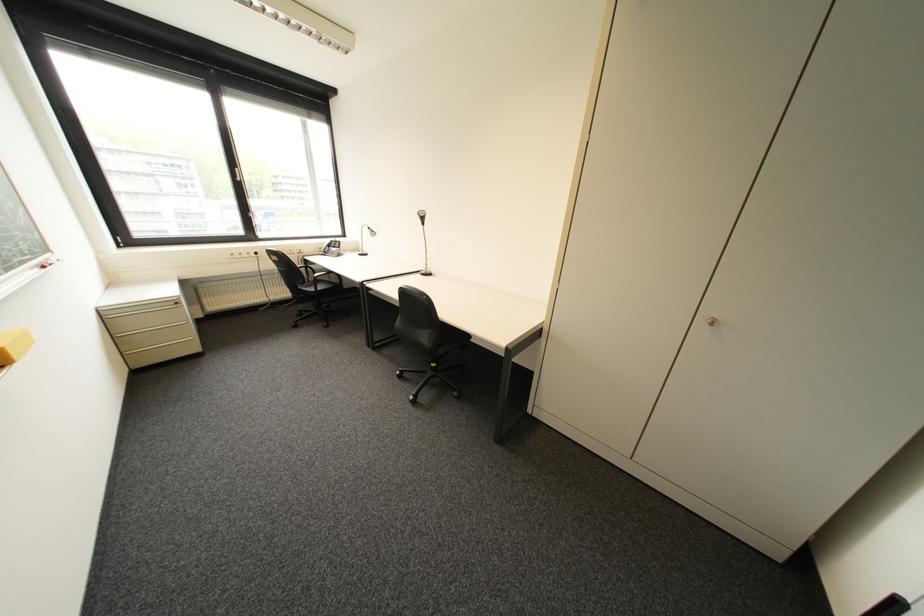
Locate an element on the screen. This screenshot has width=924, height=616. telephone handset is located at coordinates (327, 243).